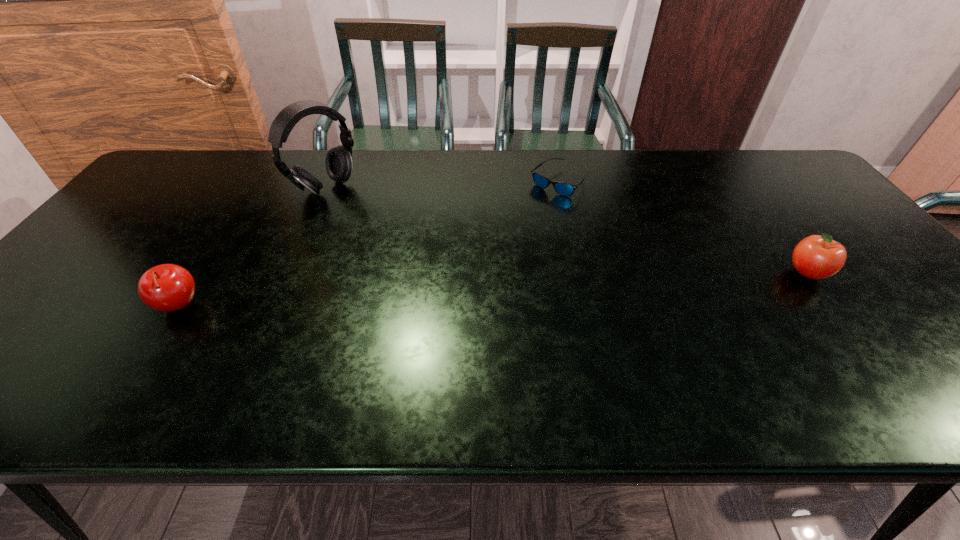
Where is `empty space that is in between the leftmost object and the rightmost object`? empty space that is in between the leftmost object and the rightmost object is located at coordinates (492, 289).

Find the location of a particular element. This screenshot has width=960, height=540. free spot between the second object from left to right and the second object from right to left is located at coordinates (443, 185).

The width and height of the screenshot is (960, 540). Find the location of `vacant area that lies between the rightmost object and the shortest object`. vacant area that lies between the rightmost object and the shortest object is located at coordinates (683, 227).

Find the location of a particular element. The width and height of the screenshot is (960, 540). free space between the rightmost object and the shortest object is located at coordinates (683, 227).

The image size is (960, 540). I want to click on empty space that is in between the leftmost object and the shortest object, so click(369, 244).

Where is `vacant space in between the second object from left to right and the apple`? The image size is (960, 540). vacant space in between the second object from left to right and the apple is located at coordinates (566, 231).

Find the location of a particular element. Image resolution: width=960 pixels, height=540 pixels. empty space that is in between the apple and the sunglasses is located at coordinates (683, 227).

Find the location of a particular element. The image size is (960, 540). vacant region between the earphone and the rightmost object is located at coordinates (566, 231).

The image size is (960, 540). Identify the location of free space between the earphone and the rightmost object. (566, 231).

Locate an element on the screen. Image resolution: width=960 pixels, height=540 pixels. empty space between the second object from right to left and the earphone is located at coordinates (443, 185).